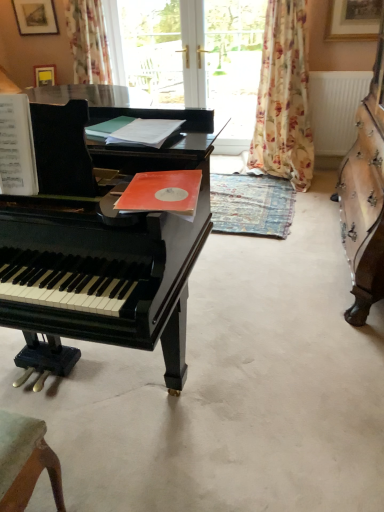
Question: Is transparent glass door at upper center, the second window screen when ordered from right to left, smaller than transparent glass door at center, marked as the 2th window screen in a left-to-right arrangement?

Choices:
 (A) no
 (B) yes

Answer: (B)

Question: From the image's perspective, is transparent glass door at upper center, which is the first window screen in left-to-right order, located above transparent glass door at center, marked as the 1th window screen in a right-to-left arrangement?

Choices:
 (A) no
 (B) yes

Answer: (B)

Question: From a real-world perspective, is transparent glass door at upper center, which is the first window screen in left-to-right order, positioned over transparent glass door at center, marked as the 1th window screen in a right-to-left arrangement, based on gravity?

Choices:
 (A) yes
 (B) no

Answer: (A)

Question: Is transparent glass door at upper center, which is the first window screen in left-to-right order, positioned far away from transparent glass door at center, marked as the 1th window screen in a right-to-left arrangement?

Choices:
 (A) yes
 (B) no

Answer: (B)

Question: Is transparent glass door at upper center, the second window screen when ordered from right to left, to the right of transparent glass door at center, marked as the 2th window screen in a left-to-right arrangement, from the viewer's perspective?

Choices:
 (A) no
 (B) yes

Answer: (A)

Question: From the image's perspective, relative to floral fabric curtain at upper left, positioned as the second curtain in right-to-left order, is floral fabric curtain at center, which is the 1th curtain in right-to-left order, above or below?

Choices:
 (A) above
 (B) below

Answer: (B)

Question: From a real-world perspective, is floral fabric curtain at center, which is the 1th curtain in right-to-left order, above or below floral fabric curtain at upper left, positioned as the second curtain in right-to-left order?

Choices:
 (A) below
 (B) above

Answer: (A)

Question: Is floral fabric curtain at center, which is the 1th curtain in right-to-left order, inside the boundaries of floral fabric curtain at upper left, positioned as the second curtain in right-to-left order, or outside?

Choices:
 (A) inside
 (B) outside

Answer: (B)

Question: Is point (261, 150) positioned closer to the camera than point (82, 82)?

Choices:
 (A) farther
 (B) closer

Answer: (B)

Question: In the image, is black piano at left on the left side or the right side of floral fabric curtain at upper left, which ranks as the 1th curtain in left-to-right order?

Choices:
 (A) left
 (B) right

Answer: (B)

Question: Considering their positions, is black piano at left located in front of or behind floral fabric curtain at upper left, positioned as the second curtain in right-to-left order?

Choices:
 (A) behind
 (B) front

Answer: (B)

Question: Is point (140, 472) positioned closer to the camera than point (107, 68)?

Choices:
 (A) farther
 (B) closer

Answer: (B)

Question: Looking at their shapes, would you say black piano at left is wider or thinner than floral fabric curtain at upper left, positioned as the second curtain in right-to-left order?

Choices:
 (A) wide
 (B) thin

Answer: (A)

Question: Is matte black harpsichord at center bigger or smaller than floral fabric curtain at center, which is the 1th curtain in right-to-left order?

Choices:
 (A) big
 (B) small

Answer: (A)

Question: In the image, is matte black harpsichord at center on the left side or the right side of floral fabric curtain at center, which is the 1th curtain in right-to-left order?

Choices:
 (A) left
 (B) right

Answer: (B)